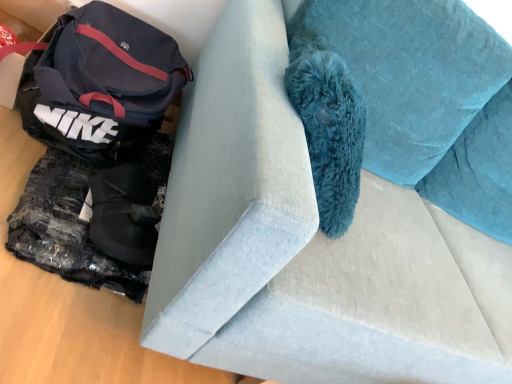
The width and height of the screenshot is (512, 384). I want to click on matte black bag at left, so click(99, 82).

What do you see at coordinates (99, 82) in the screenshot? The image size is (512, 384). I see `matte black bag at left` at bounding box center [99, 82].

Describe the element at coordinates (309, 246) in the screenshot. I see `suede couch at center` at that location.

What is the approximate width of suede couch at center?

3.53 feet.

Where is `suede couch at center`? The height and width of the screenshot is (384, 512). suede couch at center is located at coordinates (309, 246).

Locate an element on the screen. This screenshot has width=512, height=384. matte black bag at left is located at coordinates (99, 82).

Is suede couch at center at the right side of matte black bag at left?

Correct, you'll find suede couch at center to the right of matte black bag at left.

From the picture: Which is in front, suede couch at center or matte black bag at left?

Positioned in front is suede couch at center.

Does point (417, 359) come closer to viewer compared to point (89, 106)?

Yes.

From the image's perspective, is suede couch at center above matte black bag at left?

No, from the image's perspective, suede couch at center is not over matte black bag at left.

From a real-world perspective, which is physically above, suede couch at center or matte black bag at left?

suede couch at center.

Is suede couch at center wider than matte black bag at left?

Yes, suede couch at center is wider than matte black bag at left.

Consider the image. From their relative heights in the image, would you say suede couch at center is taller or shorter than matte black bag at left?

suede couch at center is taller than matte black bag at left.

Can you confirm if suede couch at center is smaller than matte black bag at left?

No.

Would you say matte black bag at left is part of suede couch at center's contents?

No, suede couch at center does not contain matte black bag at left.

Are suede couch at center and matte black bag at left beside each other?

No, suede couch at center is not making contact with matte black bag at left.

Is suede couch at center aimed at matte black bag at left?

No, suede couch at center does not turn towards matte black bag at left.

How different are the orientations of suede couch at center and matte black bag at left in degrees?

3.78 degrees separate the facing orientations of suede couch at center and matte black bag at left.

At what (x,y) coordinates should I click in order to perform the action: click on furniture that is below the matte black bag at left (from the image's perspective). Please return your answer as a coordinate pair (x, y). Looking at the image, I should click on (309, 246).

Is matte black bag at left at the right side of suede couch at center?

No, matte black bag at left is not to the right of suede couch at center.

Considering the positions of objects matte black bag at left and suede couch at center in the image provided, who is behind, matte black bag at left or suede couch at center?

matte black bag at left is further away from the camera.

Does point (95, 150) come in front of point (497, 304)?

No, (95, 150) is further to viewer.

From the image's perspective, is matte black bag at left above suede couch at center?

Correct, matte black bag at left appears higher than suede couch at center in the image.

From a real-world perspective, is matte black bag at left positioned over suede couch at center based on gravity?

No, from a real-world perspective, matte black bag at left is not over suede couch at center

Considering the relative sizes of matte black bag at left and suede couch at center in the image provided, is matte black bag at left wider than suede couch at center?

Incorrect, the width of matte black bag at left does not surpass that of suede couch at center.

Considering the sizes of objects matte black bag at left and suede couch at center in the image provided, who is shorter, matte black bag at left or suede couch at center?

matte black bag at left is shorter.

Who is smaller, matte black bag at left or suede couch at center?

matte black bag at left is smaller.

Is matte black bag at left completely or partially outside of suede couch at center?

matte black bag at left lies outside suede couch at center's area.

Are matte black bag at left and suede couch at center making contact?

matte black bag at left is not next to suede couch at center, and they're not touching.

Looking at this image, does matte black bag at left turn towards suede couch at center?

No, matte black bag at left is not turned towards suede couch at center.

How distant is matte black bag at left from suede couch at center?

matte black bag at left and suede couch at center are 19.85 inches apart.

The height and width of the screenshot is (384, 512). In order to click on luggage and bags to the left of suede couch at center in this screenshot , I will do pyautogui.click(x=99, y=82).

At what (x,y) coordinates should I click in order to perform the action: click on furniture in front of the matte black bag at left. Please return your answer as a coordinate pair (x, y). The height and width of the screenshot is (384, 512). Looking at the image, I should click on (309, 246).

Where is `luggage and bags on the left of the suede couch at center`? luggage and bags on the left of the suede couch at center is located at coordinates click(99, 82).